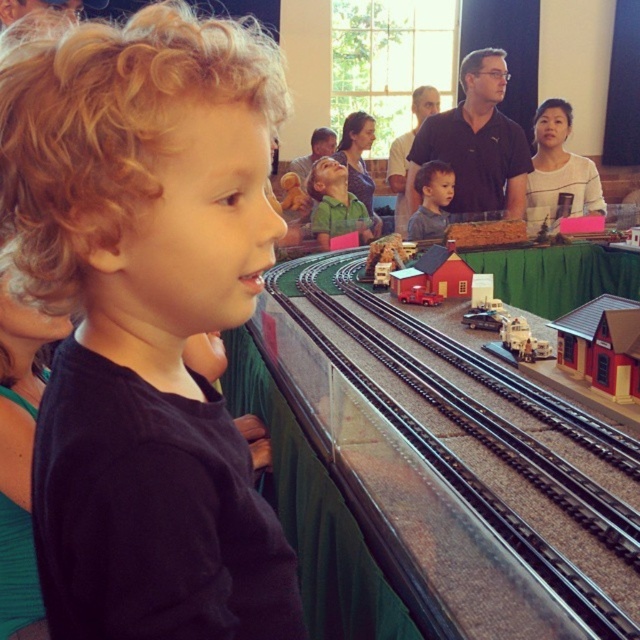
Is point (241, 100) closer to camera compared to point (428, 556)?

Yes, point (241, 100) is closer to viewer.

Between black matte shirt at left and black metal track at center, which one has less height?

black metal track at center is shorter.

Who is more forward, (234, 593) or (609, 429)?

Point (234, 593) is more forward.

Identify the location of black matte shirt at left. (145, 320).

Can you confirm if black matte shirt at left is smaller than smooth brown hair at center?

Correct, black matte shirt at left occupies less space than smooth brown hair at center.

Can you confirm if black matte shirt at left is wider than smooth brown hair at center?

In fact, black matte shirt at left might be narrower than smooth brown hair at center.

Identify the location of black matte shirt at left. (145, 320).

Who is more distant from viewer, (182, 387) or (525, 148)?

Positioned behind is point (525, 148).

Does black matte shirt at left have a greater width compared to dark blue shirt at center?

In fact, black matte shirt at left might be narrower than dark blue shirt at center.

The width and height of the screenshot is (640, 640). What do you see at coordinates (145, 320) in the screenshot?
I see `black matte shirt at left` at bounding box center [145, 320].

Image resolution: width=640 pixels, height=640 pixels. I want to click on black matte shirt at left, so click(145, 320).